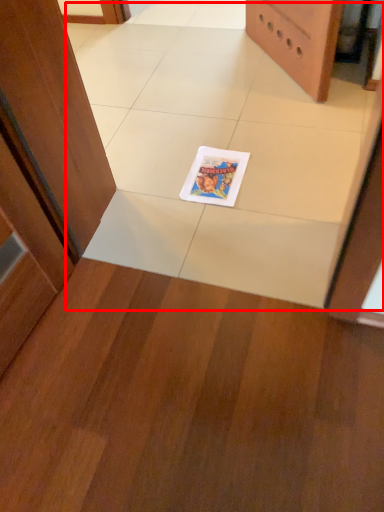
Question: Observing the image, what is the correct spatial positioning of ceramic tile (annotated by the red box) in reference to comic book?

Choices:
 (A) left
 (B) right

Answer: (A)